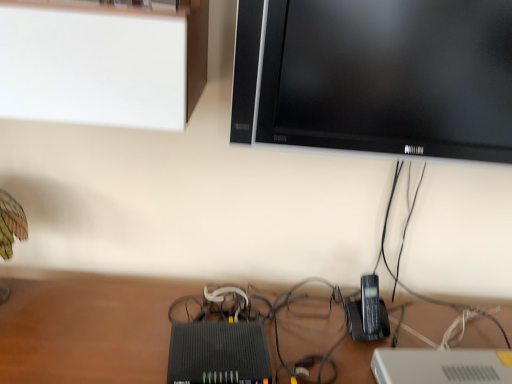
Image resolution: width=512 pixels, height=384 pixels. Describe the element at coordinates (369, 312) in the screenshot. I see `black plastic phone at lower right` at that location.

The image size is (512, 384). Find the location of `black plastic phone at lower right`. black plastic phone at lower right is located at coordinates (369, 312).

This screenshot has height=384, width=512. What do you see at coordinates (389, 76) in the screenshot?
I see `black glossy tv at upper right` at bounding box center [389, 76].

At what (x,y) coordinates should I click in order to perform the action: click on black glossy tv at upper right. Please return your answer as a coordinate pair (x, y). The height and width of the screenshot is (384, 512). Looking at the image, I should click on tap(389, 76).

Locate an element on the screen. This screenshot has height=384, width=512. black plastic phone at lower right is located at coordinates (369, 312).

Which object is positioned more to the right, black glossy tv at upper right or black plastic phone at lower right?

Positioned to the right is black glossy tv at upper right.

Is black glossy tv at upper right behind black plastic phone at lower right?

No.

Is point (369, 128) closer to viewer compared to point (368, 309)?

Yes, it is in front of point (368, 309).

From the image's perspective, between black glossy tv at upper right and black plastic phone at lower right, which one is located above?

black glossy tv at upper right is shown above in the image.

From a real-world perspective, who is located lower, black glossy tv at upper right or black plastic phone at lower right?

From a 3D spatial view, black plastic phone at lower right is below.

Considering the relative sizes of black glossy tv at upper right and black plastic phone at lower right in the image provided, is black glossy tv at upper right thinner than black plastic phone at lower right?

Indeed, black glossy tv at upper right has a lesser width compared to black plastic phone at lower right.

From the picture: Which of these two, black glossy tv at upper right or black plastic phone at lower right, stands taller?

black glossy tv at upper right is taller.

In the scene shown: Considering the relative sizes of black glossy tv at upper right and black plastic phone at lower right in the image provided, is black glossy tv at upper right smaller than black plastic phone at lower right?

No, black glossy tv at upper right is not smaller than black plastic phone at lower right.

Which is correct: black glossy tv at upper right is inside black plastic phone at lower right, or outside of it?

black glossy tv at upper right lies outside black plastic phone at lower right.

Are black glossy tv at upper right and black plastic phone at lower right far apart?

No, black glossy tv at upper right is in close proximity to black plastic phone at lower right.

Is black glossy tv at upper right oriented towards black plastic phone at lower right?

No.

Locate an element on the screen. The width and height of the screenshot is (512, 384). television located in front of the black plastic phone at lower right is located at coordinates (389, 76).

Can you confirm if black plastic phone at lower right is positioned to the right of black glossy tv at upper right?

No, black plastic phone at lower right is not to the right of black glossy tv at upper right.

Which object is further away from the camera taking this photo, black plastic phone at lower right or black glossy tv at upper right?

Positioned behind is black plastic phone at lower right.

Is point (350, 309) closer to camera compared to point (433, 10)?

That is False.

From the image's perspective, is black plastic phone at lower right under black glossy tv at upper right?

Correct, black plastic phone at lower right appears lower than black glossy tv at upper right in the image.

From a real-world perspective, is black plastic phone at lower right physically located above or below black glossy tv at upper right?

Clearly, from a real-world perspective, black plastic phone at lower right is below black glossy tv at upper right.

Considering the sizes of black plastic phone at lower right and black glossy tv at upper right in the image, is black plastic phone at lower right wider or thinner than black glossy tv at upper right?

Clearly, black plastic phone at lower right has more width compared to black glossy tv at upper right.

Between black plastic phone at lower right and black glossy tv at upper right, which one has more height?

black glossy tv at upper right is taller.

Considering the relative sizes of black plastic phone at lower right and black glossy tv at upper right in the image provided, is black plastic phone at lower right smaller than black glossy tv at upper right?

Indeed, black plastic phone at lower right has a smaller size compared to black glossy tv at upper right.

Is black plastic phone at lower right surrounding black glossy tv at upper right?

No, black glossy tv at upper right is not inside black plastic phone at lower right.

In the scene shown: Would you consider black plastic phone at lower right to be distant from black glossy tv at upper right?

Actually, black plastic phone at lower right and black glossy tv at upper right are a little close together.

Is black plastic phone at lower right facing towards black glossy tv at upper right?

No, black plastic phone at lower right is not facing towards black glossy tv at upper right.

What are the coordinates of `television located above the black plastic phone at lower right (from a real-world perspective)` in the screenshot? It's located at (389, 76).

At what (x,y) coordinates should I click in order to perform the action: click on gadget lying below the black glossy tv at upper right (from the image's perspective). Please return your answer as a coordinate pair (x, y). Looking at the image, I should click on (369, 312).

The width and height of the screenshot is (512, 384). Identify the location of gadget behind the black glossy tv at upper right. (369, 312).